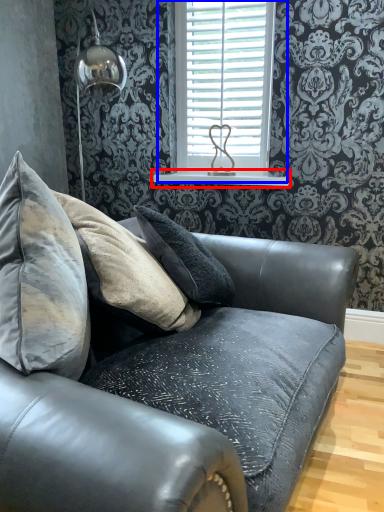
Question: Which object is closer to the camera taking this photo, window sill (highlighted by a red box) or window (highlighted by a blue box)?

Choices:
 (A) window sill
 (B) window

Answer: (B)